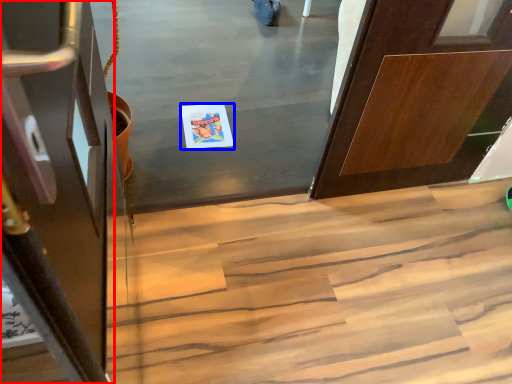
Question: Which object appears closest to the camera in this image, door (highlighted by a red box) or postcard (highlighted by a blue box)?

Choices:
 (A) door
 (B) postcard

Answer: (A)